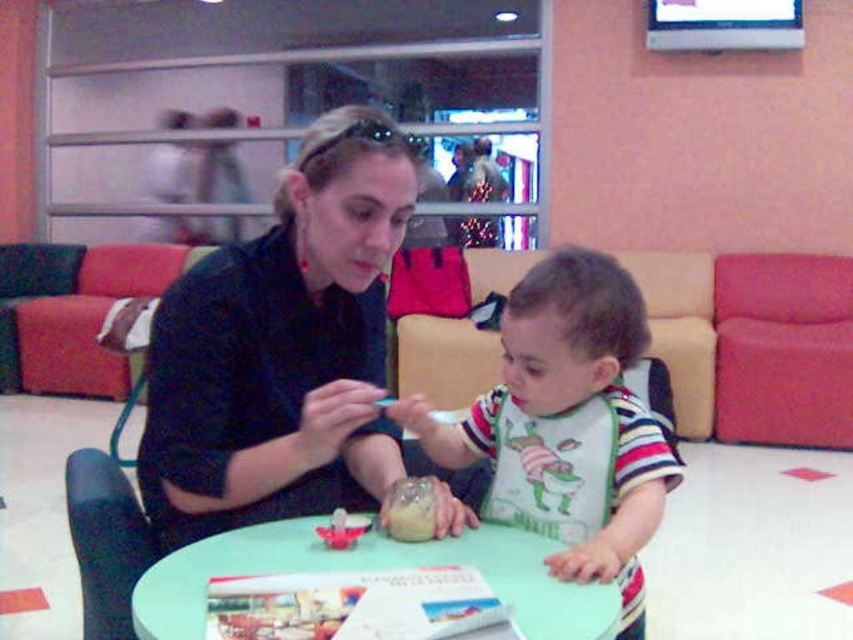
Can you confirm if matte black shirt at center is positioned below green plastic table at center?

No.

Is matte black shirt at center taller than green plastic table at center?

Yes, matte black shirt at center is taller than green plastic table at center.

Is point (361, 456) behind point (471, 538)?

Yes, it is behind point (471, 538).

Where is `matte black shirt at center`? The width and height of the screenshot is (853, 640). matte black shirt at center is located at coordinates (282, 348).

Is matte black shirt at center thinner than translucent plastic cup at table?

No.

Who is lower down, matte black shirt at center or translucent plastic cup at table?

Positioned lower is translucent plastic cup at table.

Locate an element on the screen. matte black shirt at center is located at coordinates (282, 348).

Where is `matte black shirt at center`? matte black shirt at center is located at coordinates (282, 348).

Is matte black shirt at center thinner than striped cotton bib at center?

No.

How far apart are matte black shirt at center and striped cotton bib at center?

matte black shirt at center is 9.22 inches from striped cotton bib at center.

Is point (283, 355) farther from camera compared to point (633, 451)?

Yes, it is.

Where is `matte black shirt at center`? The width and height of the screenshot is (853, 640). matte black shirt at center is located at coordinates (282, 348).